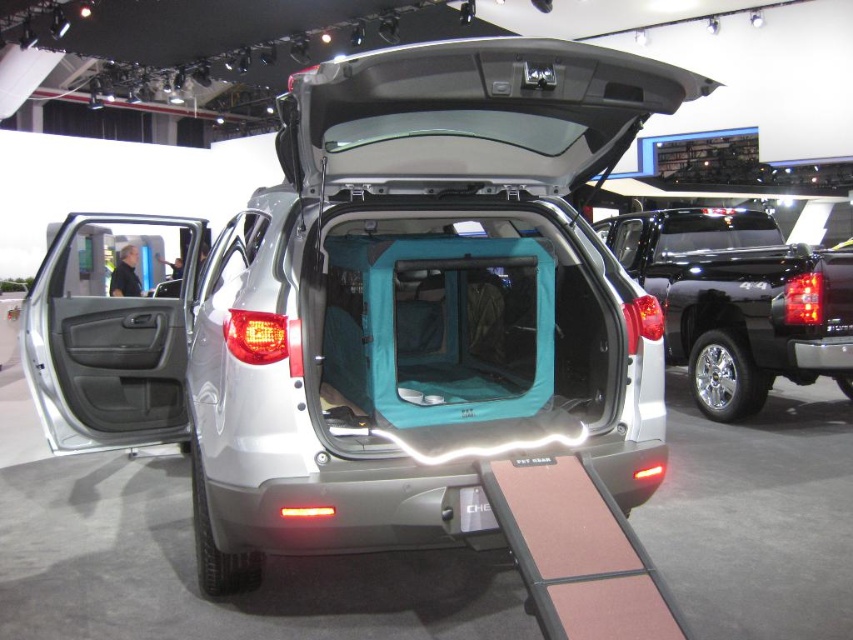
Which of these two, satin silver car at center or satin black truck at center, stands shorter?

satin silver car at center

What are the coordinates of `satin silver car at center` in the screenshot? It's located at (380, 308).

Locate an element on the screen. satin silver car at center is located at coordinates (380, 308).